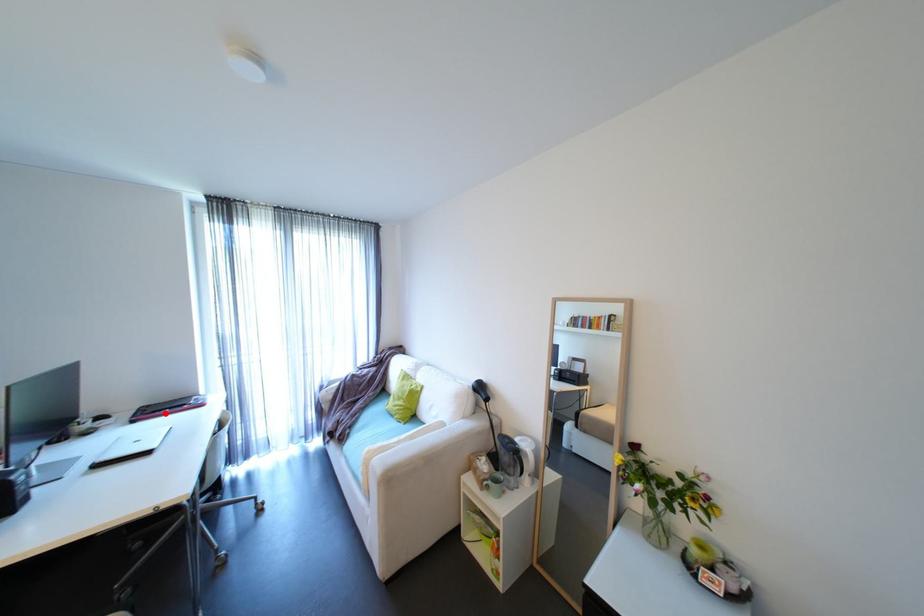
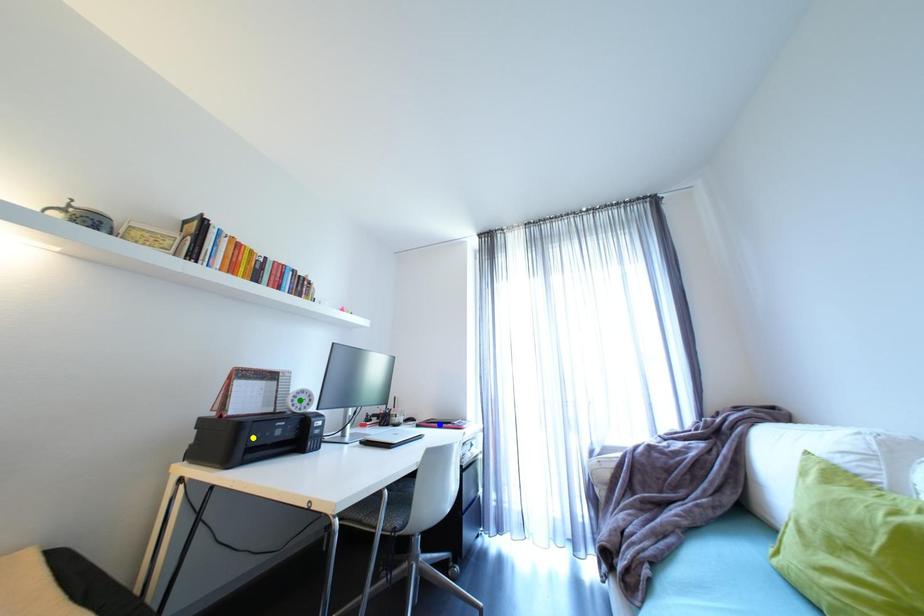
Question: I am providing you with two images of the same scene from different viewpoints. A red point is marked on the first image. You are given multiple points on the second image. Which point in image 2 represents the same 3d spot as the red point in image 1?

Choices:
 (A) yellow point
 (B) green point
 (C) blue point

Answer: (C)